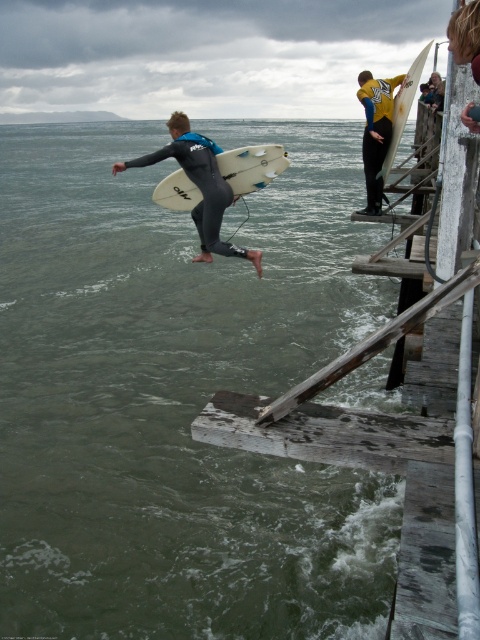
Question: Is matte black wetsuit at center positioned at the back of white matte surfboard at center?

Choices:
 (A) yes
 (B) no

Answer: (B)

Question: Can you confirm if matte black wetsuit at center is positioned to the left of yellow matte wetsuit at upper right?

Choices:
 (A) yes
 (B) no

Answer: (A)

Question: Which object is closer to the camera taking this photo?

Choices:
 (A) matte black wetsuit at center
 (B) white matte surfboard at center

Answer: (A)

Question: Which object is positioned farthest from the white matte surfboard at center?

Choices:
 (A) matte black wetsuit at center
 (B) yellow matte wetsuit at upper right

Answer: (B)

Question: Which of the following is the farthest from the observer?

Choices:
 (A) white glossy surfboard at upper right
 (B) yellow matte wetsuit at upper right
 (C) matte black wetsuit at center

Answer: (B)

Question: Is yellow matte wetsuit at upper right further to camera compared to white glossy surfboard at upper right?

Choices:
 (A) no
 (B) yes

Answer: (B)